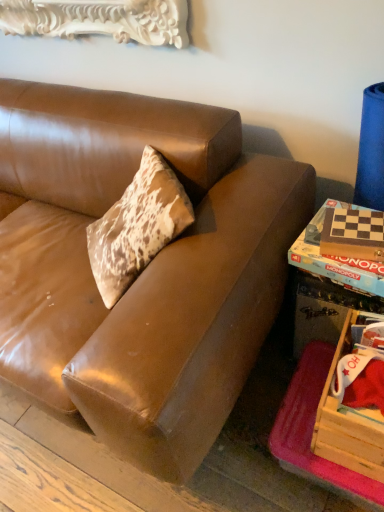
Describe the element at coordinates (353, 234) in the screenshot. The height and width of the screenshot is (512, 384). I see `checkerboard wood game board at right, the first book when ordered from front to back` at that location.

The width and height of the screenshot is (384, 512). Describe the element at coordinates (143, 272) in the screenshot. I see `brown leather couch at center` at that location.

Where is `wooden game board at lower right`? The height and width of the screenshot is (512, 384). wooden game board at lower right is located at coordinates (324, 310).

You are a GUI agent. You are given a task and a screenshot of the screen. Output one action in this format:
    pyautogui.click(x=<x>, y=<y>)
    Task: Click on the wooden crate at lower right
    
    Given the screenshot: What is the action you would take?
    pyautogui.click(x=348, y=424)

Considering the positions of objects brown leather couch at center and white carved wood picture frame at upper left in the image provided, who is in front, brown leather couch at center or white carved wood picture frame at upper left?

brown leather couch at center.

How far apart are brown leather couch at center and white carved wood picture frame at upper left?

brown leather couch at center and white carved wood picture frame at upper left are 26.33 inches apart from each other.

Between brown leather couch at center and white carved wood picture frame at upper left, which one appears on the right side from the viewer's perspective?

white carved wood picture frame at upper left is more to the right.

Is brown leather couch at center wider than white carved wood picture frame at upper left?

Yes, brown leather couch at center is wider than white carved wood picture frame at upper left.

Does point (332, 444) come in front of point (327, 286)?

Yes, point (332, 444) is in front of point (327, 286).

Is wooden crate at lower right with wooden game board at lower right?

No, wooden crate at lower right is not beside wooden game board at lower right.

Is wooden crate at lower right behind wooden game board at lower right?

No, wooden crate at lower right is in front of wooden game board at lower right.

Is wooden crate at lower right at the left side of wooden game board at lower right?

Indeed, wooden crate at lower right is positioned on the left side of wooden game board at lower right.

Identify the location of the 1st book directly above the wooden game board at lower right (from a real-world perspective). (335, 257).

How much distance is there between wooden game board at lower right and wooden monopoly game at right, placed as the second book when sorted from front to back?

wooden game board at lower right is 13.11 centimeters away from wooden monopoly game at right, placed as the second book when sorted from front to back.

Is wooden game board at lower right positioned far away from wooden monopoly game at right, placed as the second book when sorted from front to back?

No, there isn't a large distance between wooden game board at lower right and wooden monopoly game at right, placed as the second book when sorted from front to back.

Is wooden game board at lower right facing away from wooden monopoly game at right, placed as the first book when sorted from back to front?

No, wooden game board at lower right is not facing away from wooden monopoly game at right, placed as the first book when sorted from back to front.

In the image, is wooden game board at lower right on the left side or the right side of white carved wood picture frame at upper left?

In the image, wooden game board at lower right appears on the right side of white carved wood picture frame at upper left.

Who is smaller, wooden game board at lower right or white carved wood picture frame at upper left?

Smaller between the two is white carved wood picture frame at upper left.

Could you tell me if wooden game board at lower right is facing white carved wood picture frame at upper left?

No.

Can you tell me how much wooden crate at lower right and white carved wood picture frame at upper left differ in facing direction?

wooden crate at lower right and white carved wood picture frame at upper left are facing 2.38 degrees away from each other.

Considering the points (381, 479) and (120, 36), which point is in front, point (381, 479) or point (120, 36)?

The point (381, 479) is closer to the camera.

Who is taller, wooden crate at lower right or white carved wood picture frame at upper left?

Standing taller between the two is wooden crate at lower right.

From the picture: From a real-world perspective, between wooden crate at lower right and white carved wood picture frame at upper left, who is vertically lower?

In real-world perspective, wooden crate at lower right is lower.

Based on the photo, based on their sizes in the image, would you say brown leather couch at center is bigger or smaller than checkerboard wood game board at right, the first book when ordered from front to back?

Clearly, brown leather couch at center is larger in size than checkerboard wood game board at right, the first book when ordered from front to back.

Can you confirm if brown leather couch at center is wider than checkerboard wood game board at right, the second book from the back?

Indeed, brown leather couch at center has a greater width compared to checkerboard wood game board at right, the second book from the back.

How many degrees apart are the facing directions of brown leather couch at center and checkerboard wood game board at right, the second book from the back?

9.99 degrees separate the facing orientations of brown leather couch at center and checkerboard wood game board at right, the second book from the back.

Consider the image. Is brown leather couch at center behind checkerboard wood game board at right, the first book when ordered from front to back?

No, the depth of brown leather couch at center is less than that of checkerboard wood game board at right, the first book when ordered from front to back.

Relative to checkerboard wood game board at right, the second book from the back, is wooden crate at lower right in front or behind?

Clearly, wooden crate at lower right is in front of checkerboard wood game board at right, the second book from the back.

From a real-world perspective, does wooden crate at lower right stand above checkerboard wood game board at right, the first book when ordered from front to back?

No.

Is there a large distance between wooden crate at lower right and checkerboard wood game board at right, the first book when ordered from front to back?

wooden crate at lower right is near checkerboard wood game board at right, the first book when ordered from front to back, not far away.

Which of these two, wooden crate at lower right or checkerboard wood game board at right, the first book when ordered from front to back, stands shorter?

With less height is checkerboard wood game board at right, the first book when ordered from front to back.

Where is `studio couch that is under the white carved wood picture frame at upper left (from a real-world perspective)`? studio couch that is under the white carved wood picture frame at upper left (from a real-world perspective) is located at coordinates (143, 272).

Locate an element on the screen. The image size is (384, 512). table on the right of wooden crate at lower right is located at coordinates (324, 310).

Estimate the real-world distances between objects in this image. Which object is further from wooden crate at lower right, white carved wood picture frame at upper left or wooden game board at lower right?

white carved wood picture frame at upper left lies further to wooden crate at lower right than the other object.

Which object lies further to the anchor point wooden monopoly game at right, placed as the second book when sorted from front to back, checkerboard wood game board at right, the first book when ordered from front to back, or white carved wood picture frame at upper left?

white carved wood picture frame at upper left.

From the picture: Estimate the real-world distances between objects in this image. Which object is further from wooden game board at lower right, white carved wood picture frame at upper left or wooden crate at lower right?

Based on the image, white carved wood picture frame at upper left appears to be further to wooden game board at lower right.

Estimate the real-world distances between objects in this image. Which object is closer to wooden game board at lower right, checkerboard wood game board at right, the first book when ordered from front to back, or wooden monopoly game at right, placed as the first book when sorted from back to front?

wooden monopoly game at right, placed as the first book when sorted from back to front.

Estimate the real-world distances between objects in this image. Which object is further from white carved wood picture frame at upper left, checkerboard wood game board at right, the first book when ordered from front to back, or wooden game board at lower right?

wooden game board at lower right lies further to white carved wood picture frame at upper left than the other object.

Considering their positions, is wooden game board at lower right positioned closer to wooden crate at lower right than checkerboard wood game board at right, the second book from the back?

The object closer to wooden crate at lower right is wooden game board at lower right.

Considering their positions, is wooden game board at lower right positioned closer to wooden crate at lower right than wooden monopoly game at right, placed as the first book when sorted from back to front?

wooden game board at lower right is positioned closer to the anchor wooden crate at lower right.

Based on their spatial positions, is white carved wood picture frame at upper left or wooden crate at lower right closer to checkerboard wood game board at right, the second book from the back?

wooden crate at lower right is positioned closer to the anchor checkerboard wood game board at right, the second book from the back.

At what (x,y) coordinates should I click in order to perform the action: click on picture frame located between brown leather couch at center and checkerboard wood game board at right, the first book when ordered from front to back, in the left-right direction. Please return your answer as a coordinate pair (x, y). This screenshot has height=512, width=384. Looking at the image, I should click on (99, 19).

Where is `storage box between brown leather couch at center and wooden monopoly game at right, placed as the first book when sorted from back to front`? Image resolution: width=384 pixels, height=512 pixels. storage box between brown leather couch at center and wooden monopoly game at right, placed as the first book when sorted from back to front is located at coordinates (348, 424).

You are a GUI agent. You are given a task and a screenshot of the screen. Output one action in this format:
    pyautogui.click(x=<x>, y=<y>)
    Task: Click on the storage box between brown leather couch at center and checkerboard wood game board at right, the second book from the back, from left to right
    Image resolution: width=384 pixels, height=512 pixels.
    Given the screenshot: What is the action you would take?
    pyautogui.click(x=348, y=424)

Identify the location of storage box located between brown leather couch at center and wooden game board at lower right in the left-right direction. This screenshot has width=384, height=512. (348, 424).